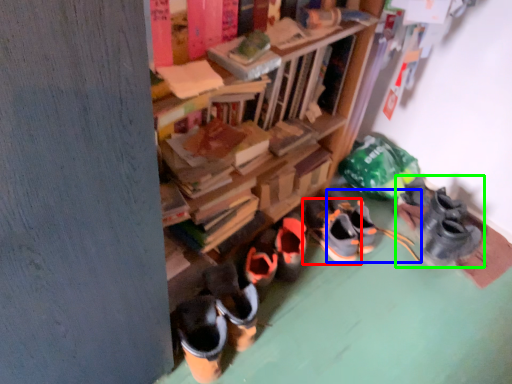
Question: Considering the real-world distances, which object is farthest from footwear (highlighted by a red box)? footwear (highlighted by a blue box) or footwear (highlighted by a green box)?

Choices:
 (A) footwear
 (B) footwear

Answer: (B)